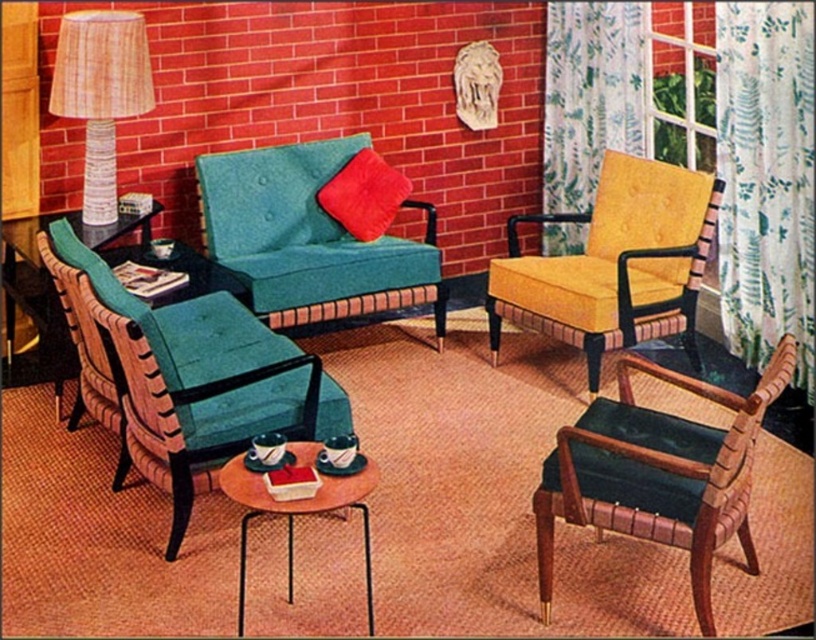
You are a decorator planning to hang a new picture frame between the green floral fabric curtain at right and the velvet red pillow at center. Since the curtain is taller than the pillow, where should you position the frame to ensure it is visible above both items?

The green floral fabric curtain at right is taller than the velvet red pillow at center, so you should position the picture frame above the green floral fabric curtain at right to ensure it is visible above both items.

You are a guest entering the living room and want to sit on the higher seating option between the teal fabric armchair at center and the teal fabric couch at center. Which one should you choose?

The teal fabric armchair at center has a greater height compared to the teal fabric couch at center, so you should choose the teal fabric armchair at center.